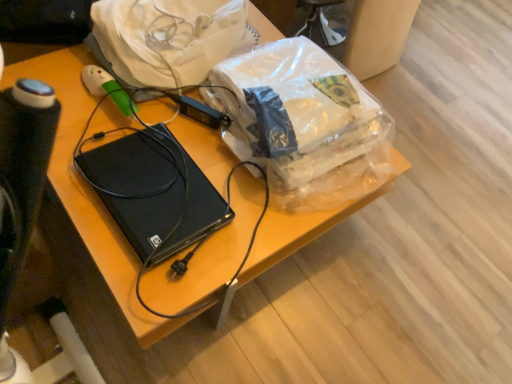
The image size is (512, 384). I want to click on vacant space situated on the left part of black plastic computer at center, so click(81, 156).